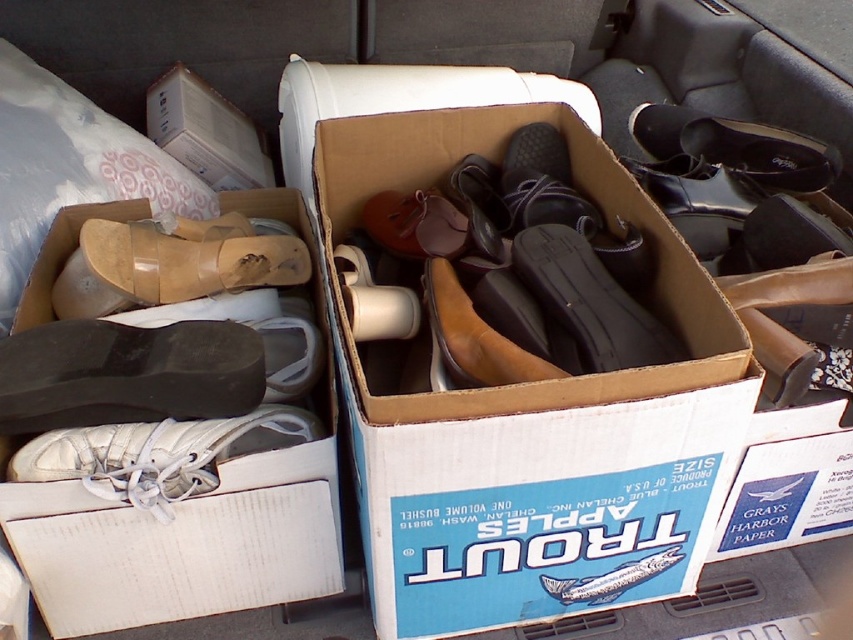
Does brown cardboard box at center have a lesser width compared to white cardboard shoebox at lower left?

In fact, brown cardboard box at center might be wider than white cardboard shoebox at lower left.

In the scene shown: Is brown cardboard box at center taller than white cardboard shoebox at lower left?

Correct, brown cardboard box at center is much taller as white cardboard shoebox at lower left.

Does point (393, 180) lie in front of point (223, 483)?

No, it is not.

At what (x,y) coordinates should I click in order to perform the action: click on brown cardboard box at center. Please return your answer as a coordinate pair (x, y). The width and height of the screenshot is (853, 640). Looking at the image, I should click on (527, 387).

Can you confirm if white leather shoe at lower left is taller than brown leather shoe at center?

Incorrect, white leather shoe at lower left's height is not larger of brown leather shoe at center's.

Image resolution: width=853 pixels, height=640 pixels. What do you see at coordinates (151, 452) in the screenshot?
I see `white leather shoe at lower left` at bounding box center [151, 452].

Find the location of a particular element. The width and height of the screenshot is (853, 640). white leather shoe at lower left is located at coordinates (151, 452).

Is brown cardboard box at center to the right of black leather shoe at upper right from the viewer's perspective?

Incorrect, brown cardboard box at center is not on the right side of black leather shoe at upper right.

Can you confirm if brown cardboard box at center is positioned above black leather shoe at upper right?

No, brown cardboard box at center is not above black leather shoe at upper right.

Which is behind, point (592, 506) or point (711, 124)?

The point (711, 124) is more distant.

At what (x,y) coordinates should I click in order to perform the action: click on brown cardboard box at center. Please return your answer as a coordinate pair (x, y). The height and width of the screenshot is (640, 853). Looking at the image, I should click on pos(527,387).